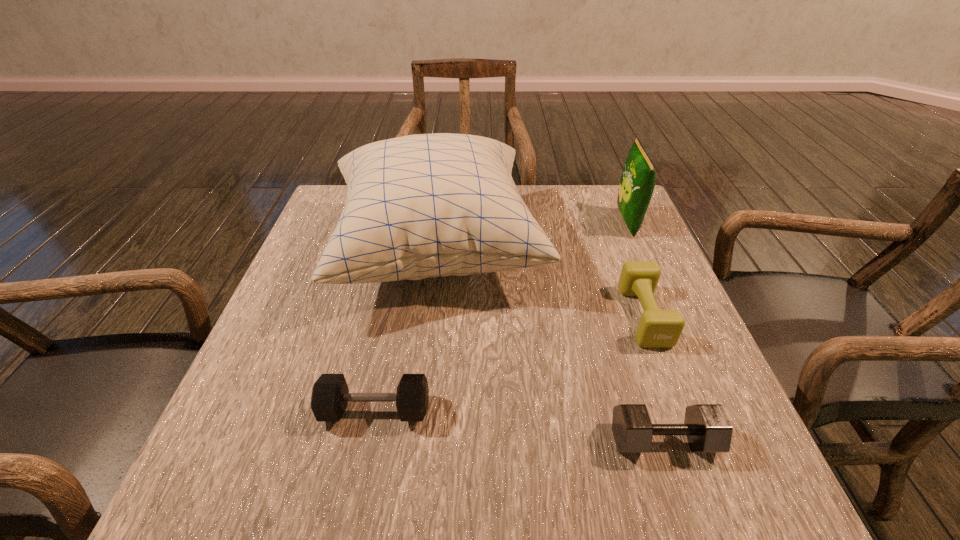
Identify the location of the tallest object. The height and width of the screenshot is (540, 960). (418, 206).

Identify the location of crisp (potato chip). The image size is (960, 540). (637, 183).

This screenshot has width=960, height=540. Identify the location of the farthest dumbbell. (657, 328).

At what (x,y) coordinates should I click in order to perform the action: click on the leftmost dumbbell. Please return your answer as a coordinate pair (x, y). The image size is (960, 540). Looking at the image, I should click on (330, 394).

Where is `vacant position located on the right of the tallest object`? This screenshot has height=540, width=960. vacant position located on the right of the tallest object is located at coordinates (654, 249).

Locate an element on the screen. The image size is (960, 540). vacant region located 0.390m on the front-facing side of the second tallest object is located at coordinates (472, 222).

This screenshot has width=960, height=540. Find the location of `free space located on the front-facing side of the second tallest object`. free space located on the front-facing side of the second tallest object is located at coordinates (558, 222).

Locate an element on the screen. free region located on the front-facing side of the second tallest object is located at coordinates (561, 222).

You are a GUI agent. You are given a task and a screenshot of the screen. Output one action in this format:
    pyautogui.click(x=<x>, y=<y>)
    Task: Click on the free space located 0.170m on the left of the farthest dumbbell
    The width and height of the screenshot is (960, 540).
    Given the screenshot: What is the action you would take?
    pyautogui.click(x=546, y=315)

At what (x,y) coordinates should I click in order to perform the action: click on free region located on the back of the leftmost dumbbell. Please return your answer as a coordinate pair (x, y). This screenshot has width=960, height=540. Looking at the image, I should click on (395, 309).